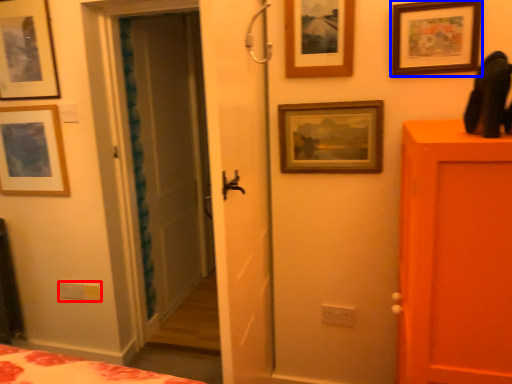
Question: Which of the following is the closest to the observer, light switch (highlighted by a red box) or picture frame (highlighted by a blue box)?

Choices:
 (A) light switch
 (B) picture frame

Answer: (B)